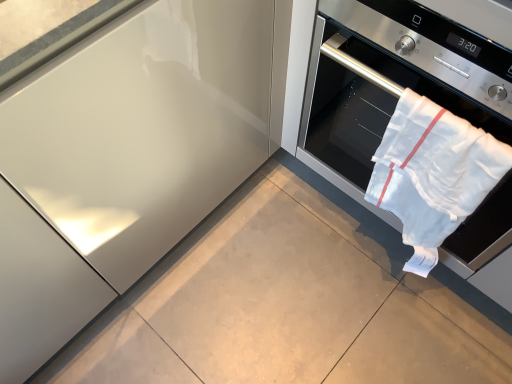
Question: Can you confirm if white cloth oven at right is shorter than white cotton towel at right?

Choices:
 (A) yes
 (B) no

Answer: (B)

Question: From the image's perspective, is white cloth oven at right on top of white cotton towel at right?

Choices:
 (A) no
 (B) yes

Answer: (B)

Question: Are white cloth oven at right and white cotton towel at right far apart?

Choices:
 (A) yes
 (B) no

Answer: (B)

Question: Is white cloth oven at right in front of white cotton towel at right?

Choices:
 (A) yes
 (B) no

Answer: (A)

Question: Can you confirm if white cloth oven at right is thinner than white cotton towel at right?

Choices:
 (A) no
 (B) yes

Answer: (A)

Question: From the image's perspective, is white cloth oven at right below white cotton towel at right?

Choices:
 (A) no
 (B) yes

Answer: (A)

Question: Are white cotton towel at right and white cloth oven at right far apart?

Choices:
 (A) yes
 (B) no

Answer: (B)

Question: Does white cotton towel at right appear on the right side of white cloth oven at right?

Choices:
 (A) yes
 (B) no

Answer: (B)

Question: Does white cotton towel at right lie in front of white cloth oven at right?

Choices:
 (A) no
 (B) yes

Answer: (A)

Question: Does white cotton towel at right have a greater height compared to white cloth oven at right?

Choices:
 (A) yes
 (B) no

Answer: (B)

Question: Is white cotton towel at right positioned beyond the bounds of white cloth oven at right?

Choices:
 (A) yes
 (B) no

Answer: (B)

Question: From the image's perspective, is white cotton towel at right beneath white cloth oven at right?

Choices:
 (A) yes
 (B) no

Answer: (A)

Question: Would you say white cotton towel at right is to the left or to the right of white cloth oven at right in the picture?

Choices:
 (A) right
 (B) left

Answer: (B)